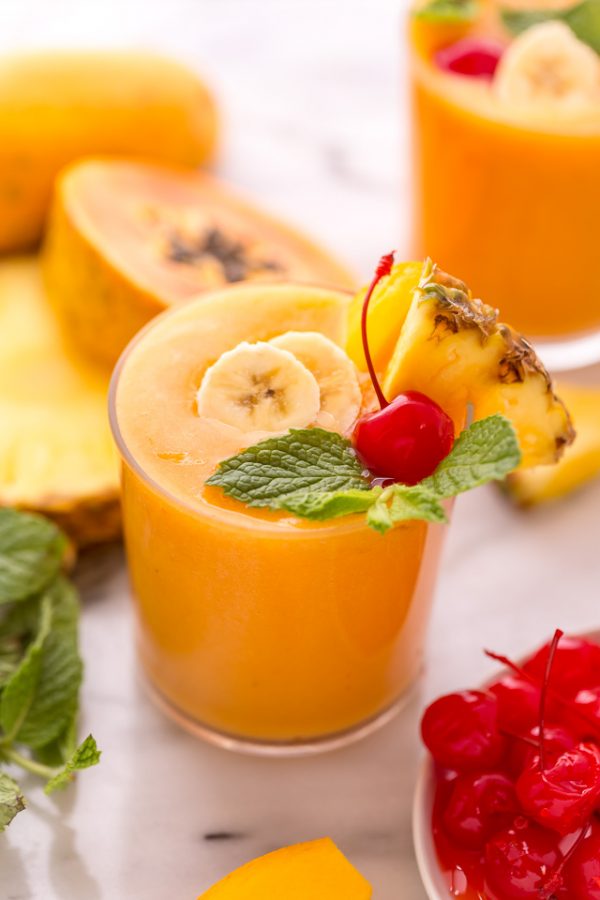
Locate an element on the screen. glass tumbler is located at coordinates (306, 591).